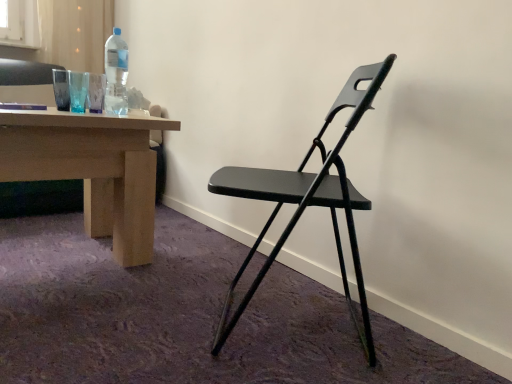
This screenshot has width=512, height=384. In order to click on free point below matte black folding chair at center (from a real-world perspective) in this screenshot , I will do `click(282, 322)`.